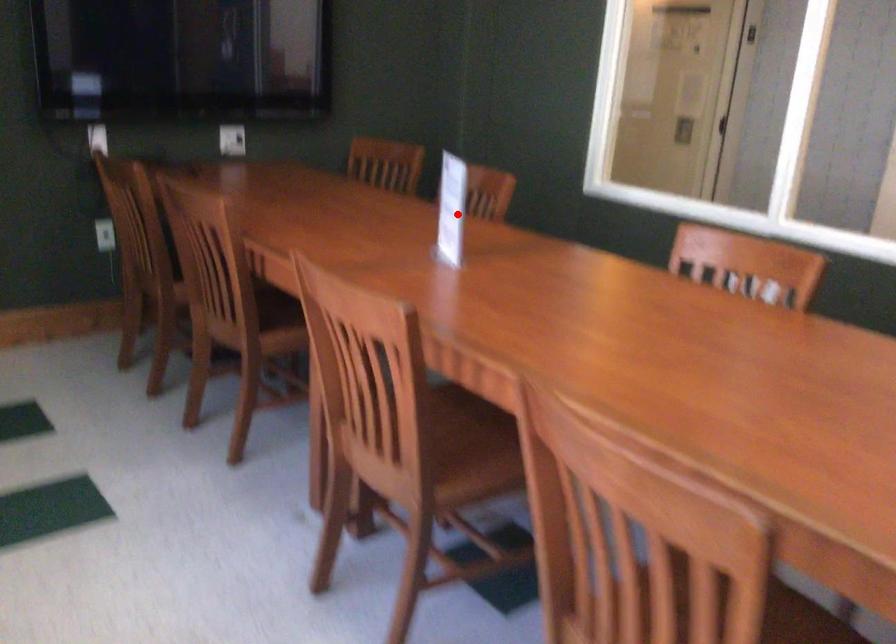
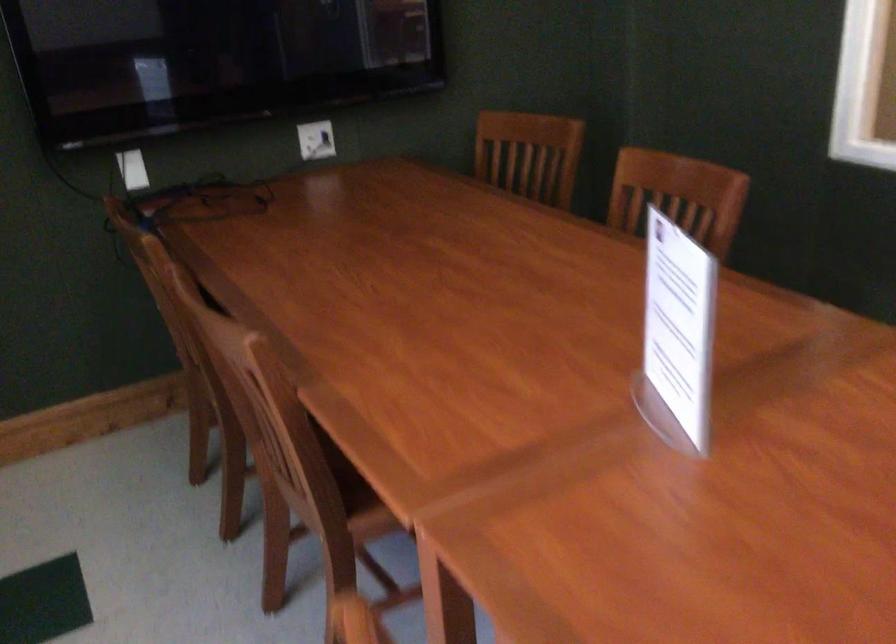
Question: I am providing you with two images of the same scene from different viewpoints. A red point is shown in image1. For the corresponding object point in image2, is it positioned nearer or farther from the camera?

Choices:
 (A) Nearer
 (B) Farther

Answer: (A)